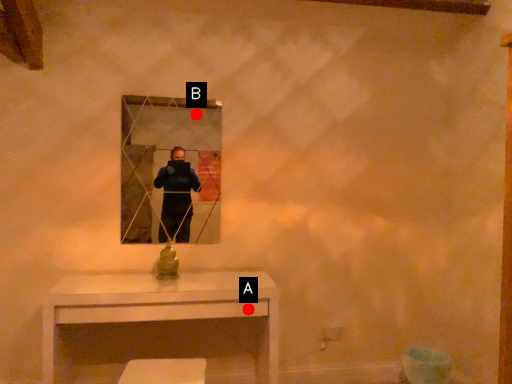
Question: Two points are circled on the image, labeled by A and B beside each circle. Which point is further to the camera?

Choices:
 (A) A is further
 (B) B is further

Answer: (B)